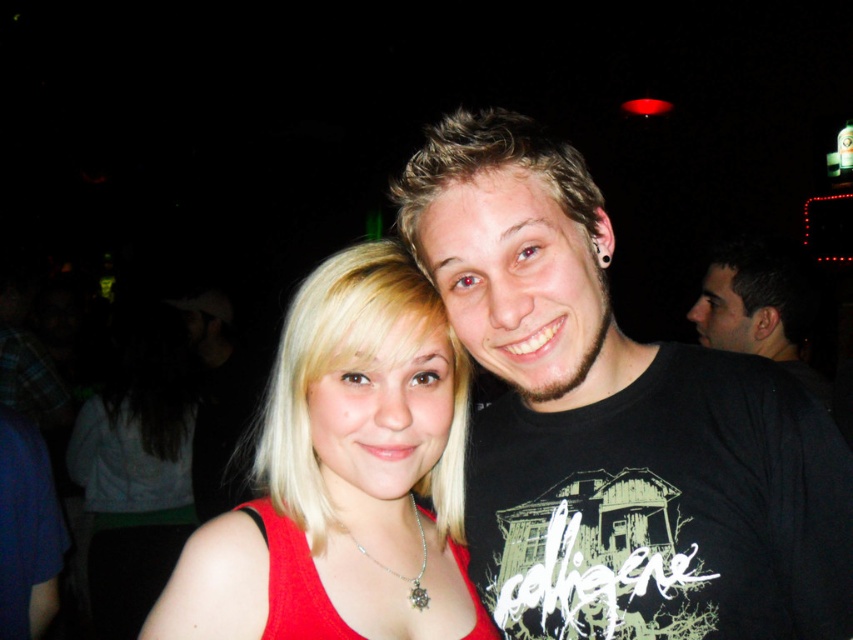
Question: Estimate the real-world distances between objects in this image. Which object is closer to the matte red tank top at center?

Choices:
 (A) black t-shirt at center
 (B) red fabric dress at center

Answer: (B)

Question: Does black t-shirt at center appear on the right side of red fabric dress at center?

Choices:
 (A) no
 (B) yes

Answer: (B)

Question: Where is matte red tank top at center located in relation to red fabric dress at center in the image?

Choices:
 (A) above
 (B) below

Answer: (A)

Question: Which object is the farthest from the black t-shirt at center?

Choices:
 (A) matte red tank top at center
 (B) red fabric dress at center

Answer: (B)

Question: Which object appears closest to the camera in this image?

Choices:
 (A) black t-shirt at center
 (B) matte red tank top at center
 (C) red fabric dress at center

Answer: (B)

Question: Can you confirm if black t-shirt at center is bigger than red fabric dress at center?

Choices:
 (A) yes
 (B) no

Answer: (A)